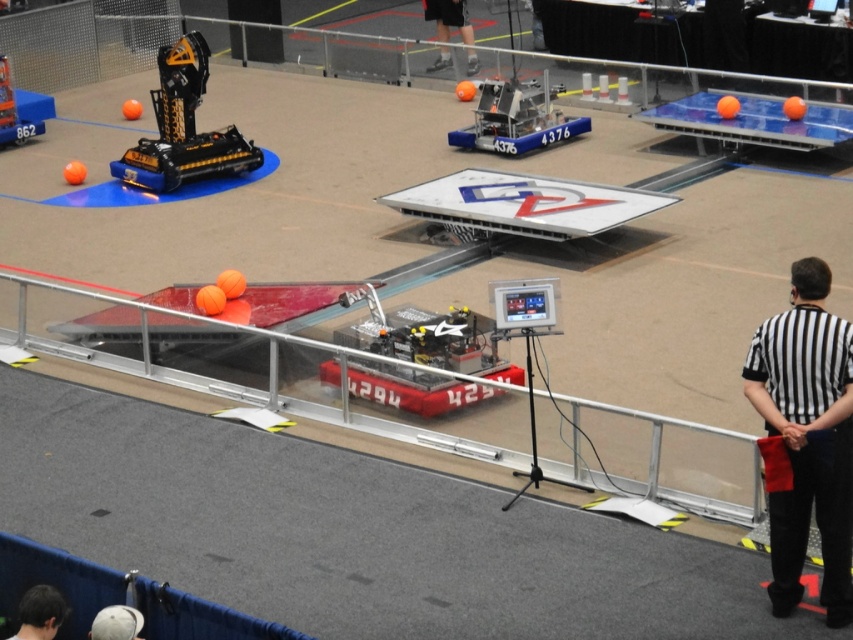
The width and height of the screenshot is (853, 640). What do you see at coordinates (183, 128) in the screenshot? I see `black plastic robot at upper left` at bounding box center [183, 128].

Who is shorter, black plastic robot at upper left or dark brown hair at lower left?

With less height is dark brown hair at lower left.

The height and width of the screenshot is (640, 853). Describe the element at coordinates (183, 128) in the screenshot. I see `black plastic robot at upper left` at that location.

What are the coordinates of `black plastic robot at upper left` in the screenshot? It's located at (183, 128).

Does dark brown hair at lower left appear under black fabric pants at upper center?

Indeed, dark brown hair at lower left is positioned under black fabric pants at upper center.

Measure the distance between dark brown hair at lower left and black fabric pants at upper center.

The distance of dark brown hair at lower left from black fabric pants at upper center is 19.27 meters.

Between point (18, 612) and point (467, 38), which one is positioned in front?

Positioned in front is point (18, 612).

This screenshot has height=640, width=853. In order to click on dark brown hair at lower left in this screenshot , I will do `click(39, 612)`.

Does point (189, 140) come behind point (426, 6)?

That is False.

Does black plastic robot at upper left appear under black fabric pants at upper center?

Yes, black plastic robot at upper left is below black fabric pants at upper center.

Which is behind, point (196, 148) or point (433, 6)?

The point (433, 6) is more distant.

Identify the location of black plastic robot at upper left. This screenshot has height=640, width=853. (183, 128).